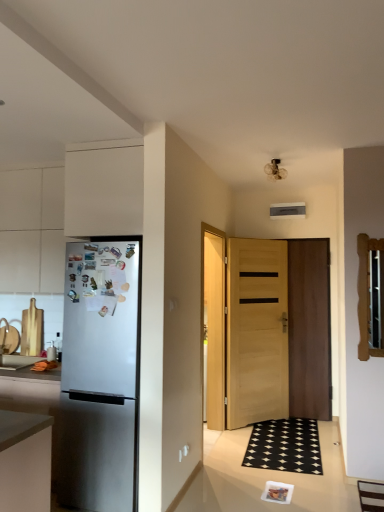
Locate an element on the screen. The height and width of the screenshot is (512, 384). vacant area in front of wooden door at center, the 2th door when ordered from left to right is located at coordinates (306, 423).